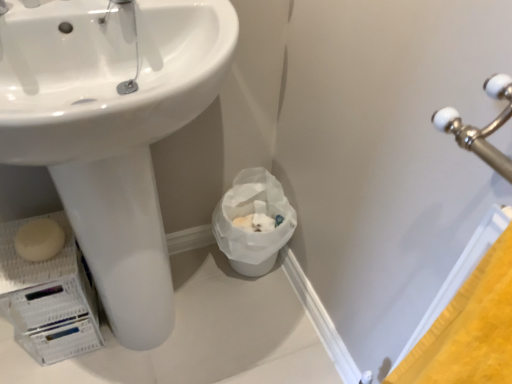
Question: Is white glossy sink at center taller than white matte soap at lower left?

Choices:
 (A) yes
 (B) no

Answer: (A)

Question: Can we say white glossy sink at center lies outside white matte soap at lower left?

Choices:
 (A) yes
 (B) no

Answer: (A)

Question: Can you confirm if white glossy sink at center is shorter than white matte soap at lower left?

Choices:
 (A) no
 (B) yes

Answer: (A)

Question: Considering the relative sizes of white glossy sink at center and white matte soap at lower left in the image provided, is white glossy sink at center thinner than white matte soap at lower left?

Choices:
 (A) no
 (B) yes

Answer: (A)

Question: Could you tell me if white glossy sink at center is turned towards white matte soap at lower left?

Choices:
 (A) no
 (B) yes

Answer: (B)

Question: Is white matte soap at lower left wider or thinner than white paper bag at lower center?

Choices:
 (A) wide
 (B) thin

Answer: (B)

Question: From the image's perspective, is white matte soap at lower left located above or below white paper bag at lower center?

Choices:
 (A) above
 (B) below

Answer: (A)

Question: Visually, is white matte soap at lower left positioned to the left or to the right of white paper bag at lower center?

Choices:
 (A) right
 (B) left

Answer: (B)

Question: Is white matte soap at lower left inside the boundaries of white paper bag at lower center, or outside?

Choices:
 (A) outside
 (B) inside

Answer: (A)

Question: Is point tap(26, 236) closer or farther from the camera than point tap(161, 61)?

Choices:
 (A) farther
 (B) closer

Answer: (A)

Question: In terms of height, does white matte soap at lower left look taller or shorter compared to white glossy sink at center?

Choices:
 (A) short
 (B) tall

Answer: (A)

Question: Would you say white matte soap at lower left is inside or outside white glossy sink at center?

Choices:
 (A) outside
 (B) inside

Answer: (B)

Question: Is white matte soap at lower left to the left or to the right of white glossy sink at center in the image?

Choices:
 (A) left
 (B) right

Answer: (A)

Question: Considering the positions of white paper bag at lower center and white matte soap at lower left in the image, is white paper bag at lower center taller or shorter than white matte soap at lower left?

Choices:
 (A) tall
 (B) short

Answer: (A)

Question: Based on their positions, is white paper bag at lower center located to the left or right of white matte soap at lower left?

Choices:
 (A) left
 (B) right

Answer: (B)